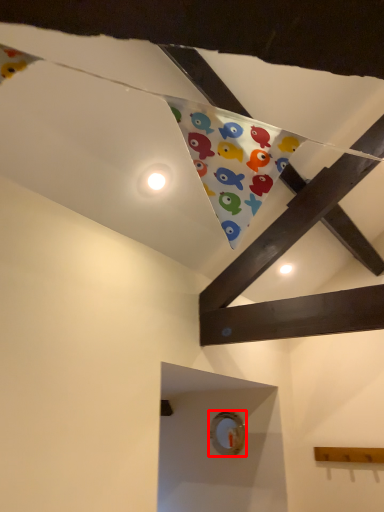
Question: From the image's perspective, what is the correct spatial relationship of button (annotated by the red box) in relation to button?

Choices:
 (A) below
 (B) above

Answer: (A)